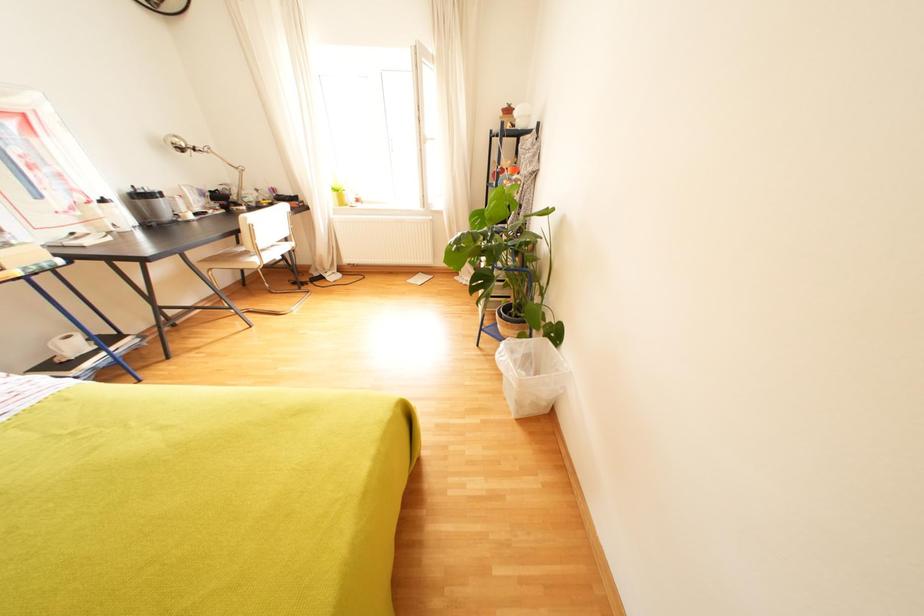
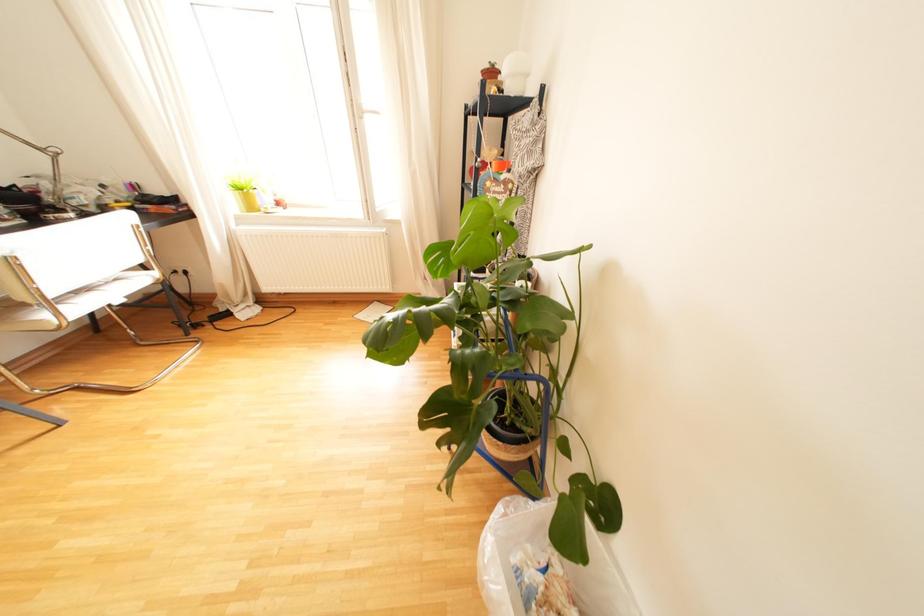
Question: The images are taken continuously from a first-person perspective. In which direction are you moving?

Choices:
 (A) Left
 (B) Right
 (C) Forward
 (D) Backward

Answer: (C)